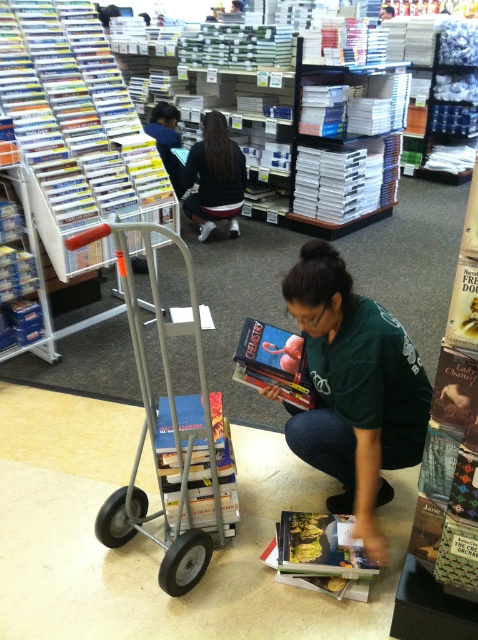
You are a customer in the bookstore and want to find the hardcover book at lower center. Based on its coordinates, where should you look?

The hardcover book at lower center is located at coordinates point (318, 556), so you should look towards the lower center area of the image.

What object is located at the coordinates point (76, 124)?

The point (76, 124) corresponds to the white glossy book at upper left.